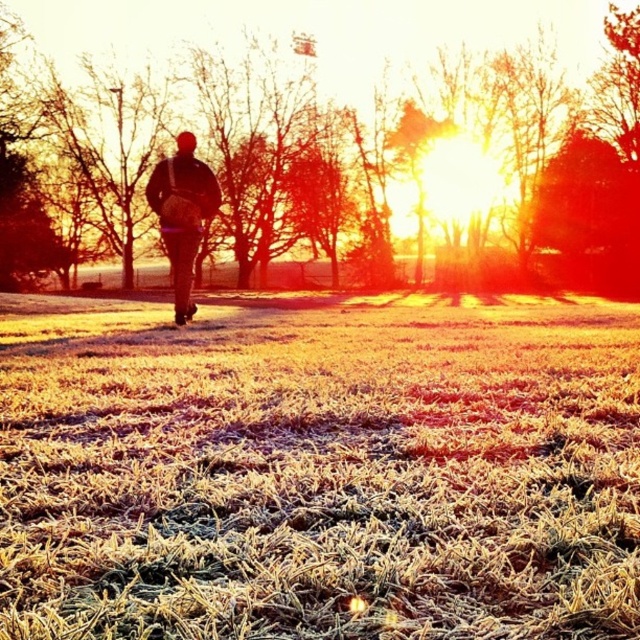
Question: Which object appears farthest from the camera in this image?

Choices:
 (A) frosted grass at center
 (B) matte brown backpack at center

Answer: (B)

Question: Among these objects, which one is farthest from the camera?

Choices:
 (A) frosted grass at center
 (B) matte brown backpack at center

Answer: (B)

Question: Does frosted grass at center appear over matte brown backpack at center?

Choices:
 (A) yes
 (B) no

Answer: (B)

Question: From the image, what is the correct spatial relationship of frosted grass at center in relation to matte brown backpack at center?

Choices:
 (A) left
 (B) right

Answer: (B)

Question: Is frosted grass at center thinner than matte brown backpack at center?

Choices:
 (A) no
 (B) yes

Answer: (A)